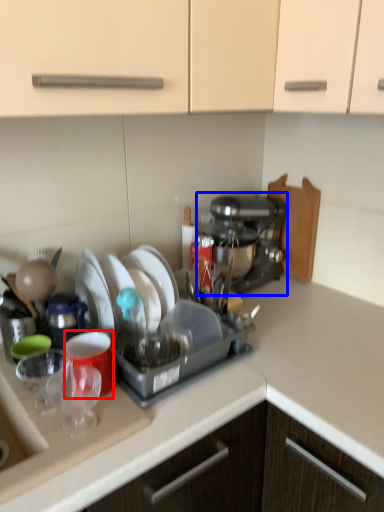
Question: Which object is closer to the camera taking this photo, coffee cup (highlighted by a red box) or coffee maker (highlighted by a blue box)?

Choices:
 (A) coffee cup
 (B) coffee maker

Answer: (A)